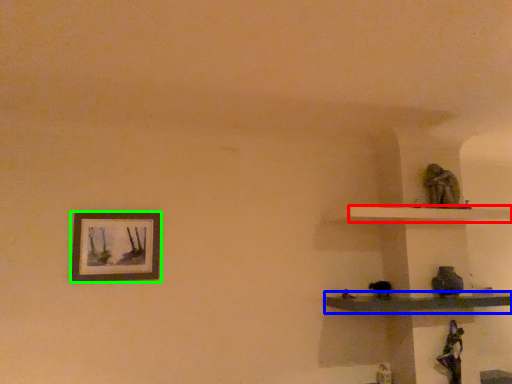
Question: Which object is positioned closest to shelf (highlighted by a red box)? Select from shelf (highlighted by a blue box) and picture frame (highlighted by a green box).

Choices:
 (A) shelf
 (B) picture frame

Answer: (A)